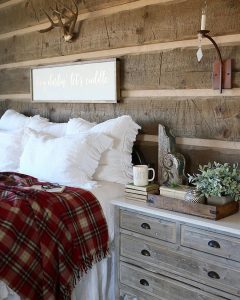
Locate an element on the screen. Image resolution: width=240 pixels, height=300 pixels. books of stack is located at coordinates (138, 194).